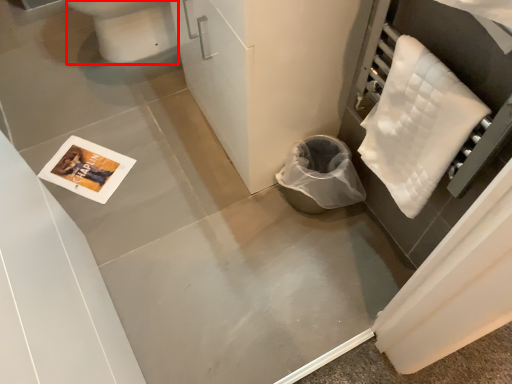
Question: From the image's perspective, what is the correct spatial relationship of toilet bowl (annotated by the red box) in relation to cloth?

Choices:
 (A) below
 (B) above

Answer: (B)